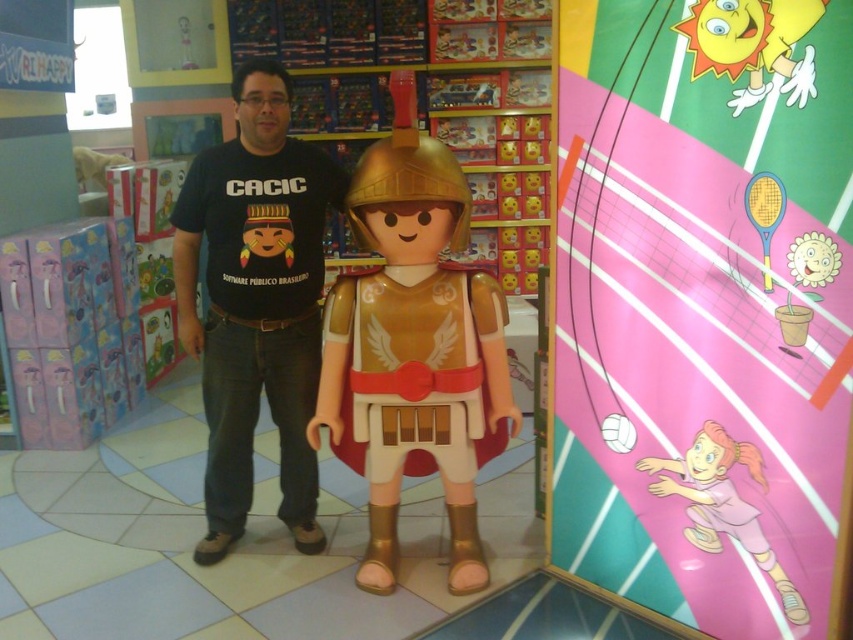
Can you confirm if matte gold armor at center is positioned below black matte t-shirt at center?

Indeed, matte gold armor at center is positioned under black matte t-shirt at center.

Who is shorter, matte gold armor at center or black matte t-shirt at center?

matte gold armor at center is shorter.

Which is behind, point (445, 337) or point (300, 516)?

Point (300, 516)

Where is `matte gold armor at center`? This screenshot has height=640, width=853. matte gold armor at center is located at coordinates (415, 348).

Does point (317, 316) lie behind point (807, 621)?

Yes.

Is black matte t-shirt at center to the left of pink matte volleyball at center from the viewer's perspective?

Yes, black matte t-shirt at center is to the left of pink matte volleyball at center.

Is point (235, 435) closer to camera compared to point (653, 492)?

No, (235, 435) is behind (653, 492).

Where is `black matte t-shirt at center`? black matte t-shirt at center is located at coordinates (256, 301).

Is matte gold armor at center behind pink matte volleyball at center?

Yes, matte gold armor at center is behind pink matte volleyball at center.

Does point (384, 314) lie behind point (740, 461)?

Yes, it is behind point (740, 461).

The width and height of the screenshot is (853, 640). In order to click on matte gold armor at center in this screenshot , I will do `click(415, 348)`.

At what (x,y) coordinates should I click in order to perform the action: click on matte gold armor at center. Please return your answer as a coordinate pair (x, y). The height and width of the screenshot is (640, 853). Looking at the image, I should click on (415, 348).